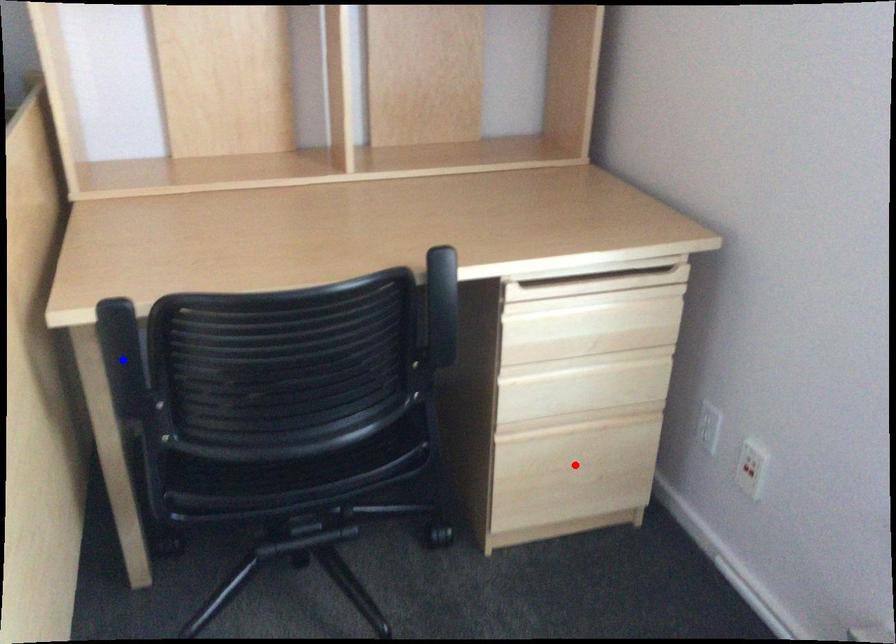
Question: Which of the two points in the image is closer to the camera?

Choices:
 (A) Blue point is closer.
 (B) Red point is closer.

Answer: (A)